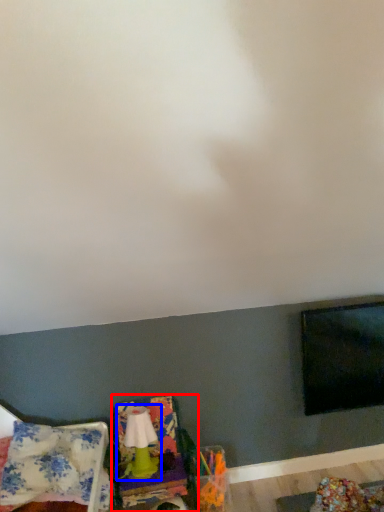
Question: Which object is further to the camera taking this photo, swivel chair (highlighted by a red box) or lamp (highlighted by a blue box)?

Choices:
 (A) swivel chair
 (B) lamp

Answer: (B)